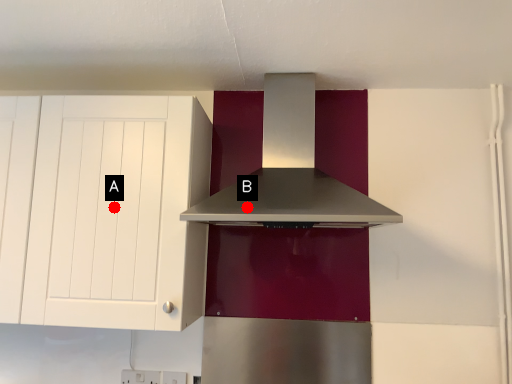
Question: Two points are circled on the image, labeled by A and B beside each circle. Which point is closer to the camera?

Choices:
 (A) A is closer
 (B) B is closer

Answer: (B)